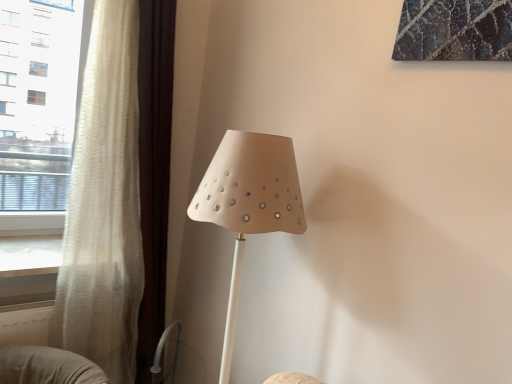
Image resolution: width=512 pixels, height=384 pixels. What do you see at coordinates (248, 202) in the screenshot?
I see `matte beige lampshade at center` at bounding box center [248, 202].

Where is `white sheer curtain at left`? The height and width of the screenshot is (384, 512). white sheer curtain at left is located at coordinates (37, 140).

From the image's perspective, is matte beige lampshade at center above or below white textured curtain at left?

matte beige lampshade at center is situated lower than white textured curtain at left in the image.

Which of these two, matte beige lampshade at center or white textured curtain at left, is wider?

matte beige lampshade at center.

Is matte beige lampshade at center turned away from white textured curtain at left?

No, matte beige lampshade at center is not facing away from white textured curtain at left.

Considering their positions, is matte beige lampshade at center located in front of or behind white textured curtain at left?

Clearly, matte beige lampshade at center is in front of white textured curtain at left.

Is the position of white textured curtain at left more distant than that of white sheer curtain at left?

No, the depth of white textured curtain at left is less than that of white sheer curtain at left.

Considering the sizes of white textured curtain at left and white sheer curtain at left in the image, is white textured curtain at left wider or thinner than white sheer curtain at left?

white textured curtain at left is wider than white sheer curtain at left.

Would you say white textured curtain at left is a long distance from white sheer curtain at left?

No, white textured curtain at left is not far from white sheer curtain at left.

In the scene shown: Is white sheer curtain at left at the back of white textured curtain at left?

Yes.

How distant is white sheer curtain at left from white textured curtain at left?

A distance of 78.72 centimeters exists between white sheer curtain at left and white textured curtain at left.

The width and height of the screenshot is (512, 384). I want to click on curtain below the white sheer curtain at left (from a real-world perspective), so click(104, 204).

Is white sheer curtain at left inside the boundaries of white textured curtain at left, or outside?

white sheer curtain at left is not inside white textured curtain at left, it's outside.

Considering the relative sizes of white sheer curtain at left and white textured curtain at left in the image provided, is white sheer curtain at left thinner than white textured curtain at left?

Yes, white sheer curtain at left is thinner than white textured curtain at left.

Which object is positioned more to the left, white textured curtain at left or matte beige lampshade at center?

white textured curtain at left is more to the left.

Find the location of a particular element. lamp below the white textured curtain at left (from a real-world perspective) is located at coordinates (248, 202).

From the picture: From a real-world perspective, which is physically below, white textured curtain at left or matte beige lampshade at center?

matte beige lampshade at center, from a real-world perspective.

Is white textured curtain at left next to matte beige lampshade at center?

white textured curtain at left and matte beige lampshade at center are not in contact.

Is white sheer curtain at left facing away from matte beige lampshade at center?

No.

In the scene shown: Who is bigger, white sheer curtain at left or matte beige lampshade at center?

matte beige lampshade at center is bigger.

Is white sheer curtain at left not inside matte beige lampshade at center?

white sheer curtain at left lies outside matte beige lampshade at center's area.

Is white sheer curtain at left positioned in front of matte beige lampshade at center?

No, white sheer curtain at left is further to the viewer.

Does matte beige lampshade at center touch white sheer curtain at left?

No.

Which of these two, matte beige lampshade at center or white sheer curtain at left, stands taller?

white sheer curtain at left.

This screenshot has height=384, width=512. Identify the location of window above the matte beige lampshade at center (from the image's perspective). (37, 140).

Can you confirm if matte beige lampshade at center is positioned to the left of white sheer curtain at left?

Incorrect, matte beige lampshade at center is not on the left side of white sheer curtain at left.

Identify the location of curtain behind the matte beige lampshade at center. (104, 204).

Identify the location of window above the white textured curtain at left (from a real-world perspective). (37, 140).

From the image, which object appears to be nearer to white sheer curtain at left, white textured curtain at left or matte beige lampshade at center?

The object closer to white sheer curtain at left is white textured curtain at left.

When comparing their distances from white sheer curtain at left, does matte beige lampshade at center or white textured curtain at left seem closer?

white textured curtain at left is positioned closer to the anchor white sheer curtain at left.

Which object lies further to the anchor point matte beige lampshade at center, white sheer curtain at left or white textured curtain at left?

Based on the image, white sheer curtain at left appears to be further to matte beige lampshade at center.

Which object lies further to the anchor point white textured curtain at left, matte beige lampshade at center or white sheer curtain at left?

Among the two, white sheer curtain at left is located further to white textured curtain at left.

Looking at this image, from the image, which object appears to be farther from matte beige lampshade at center, white textured curtain at left or white sheer curtain at left?

The object further to matte beige lampshade at center is white sheer curtain at left.

Estimate the real-world distances between objects in this image. Which object is closer to white textured curtain at left, white sheer curtain at left or matte beige lampshade at center?

matte beige lampshade at center lies closer to white textured curtain at left than the other object.

Locate an element on the screen. curtain located between white sheer curtain at left and matte beige lampshade at center in the left-right direction is located at coordinates (104, 204).